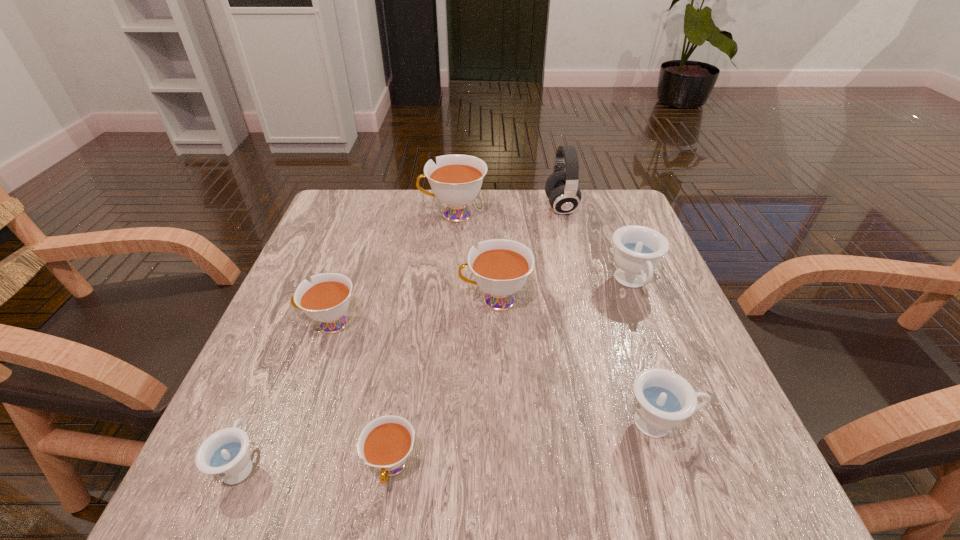
Identify which blue teacup is the second closest to the tallest teacup. Please provide its 2D coordinates. Your answer should be formatted as a tuple, i.e. [(x, y)], where the tuple contains the x and y coordinates of a point satisfying the conditions above.

[(663, 399)]

Point out which blue teacup is positioned as the nearest to the leftmost blue teacup. Please provide its 2D coordinates. Your answer should be formatted as a tuple, i.e. [(x, y)], where the tuple contains the x and y coordinates of a point satisfying the conditions above.

[(663, 399)]

Where is `free point that satisfies the following two spatial constraints: 1. on the ear cups of the tallest object; 2. on the side of the smallest white teacup with the handle`? Image resolution: width=960 pixels, height=540 pixels. free point that satisfies the following two spatial constraints: 1. on the ear cups of the tallest object; 2. on the side of the smallest white teacup with the handle is located at coordinates (628, 467).

Locate an element on the screen. The width and height of the screenshot is (960, 540). free space that satisfies the following two spatial constraints: 1. on the side of the biggest blue teacup with the handle; 2. on the side of the second biggest blue teacup with the handle is located at coordinates (686, 422).

Locate an element on the screen. The height and width of the screenshot is (540, 960). free location that satisfies the following two spatial constraints: 1. on the ear cups of the tallest object; 2. on the side of the smallest white teacup with the handle is located at coordinates (628, 467).

Where is `vacant region that satisfies the following two spatial constraints: 1. on the ear cups of the tallest object; 2. on the side of the nearest white teacup with the handle`? The image size is (960, 540). vacant region that satisfies the following two spatial constraints: 1. on the ear cups of the tallest object; 2. on the side of the nearest white teacup with the handle is located at coordinates (628, 467).